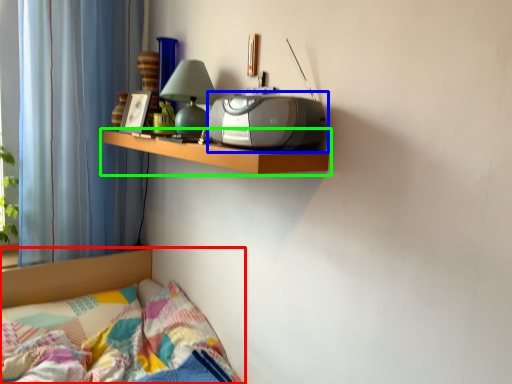
Question: Considering the real-world distances, which object is closest to bed (highlighted by a red box)? stereo (highlighted by a blue box) or shelf (highlighted by a green box).

Choices:
 (A) stereo
 (B) shelf

Answer: (B)